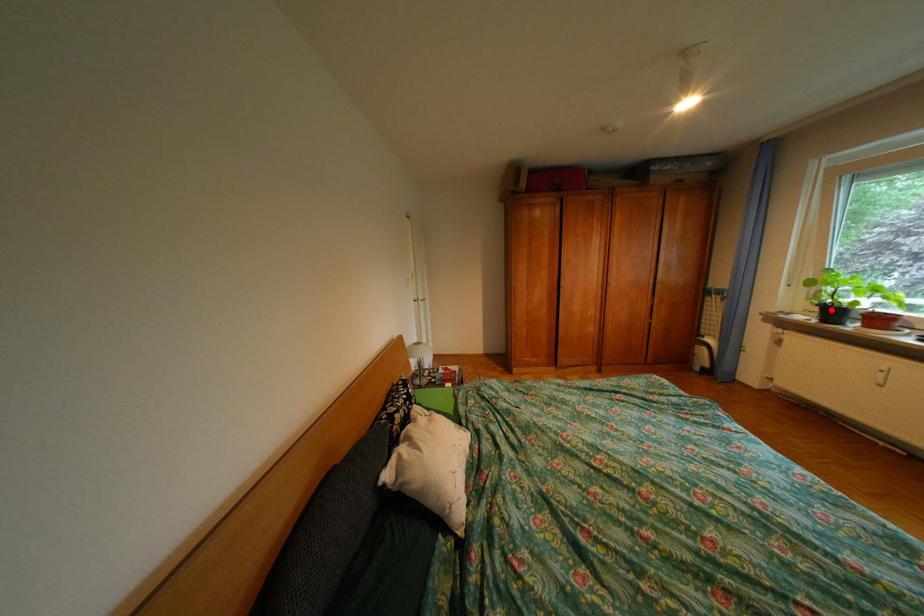
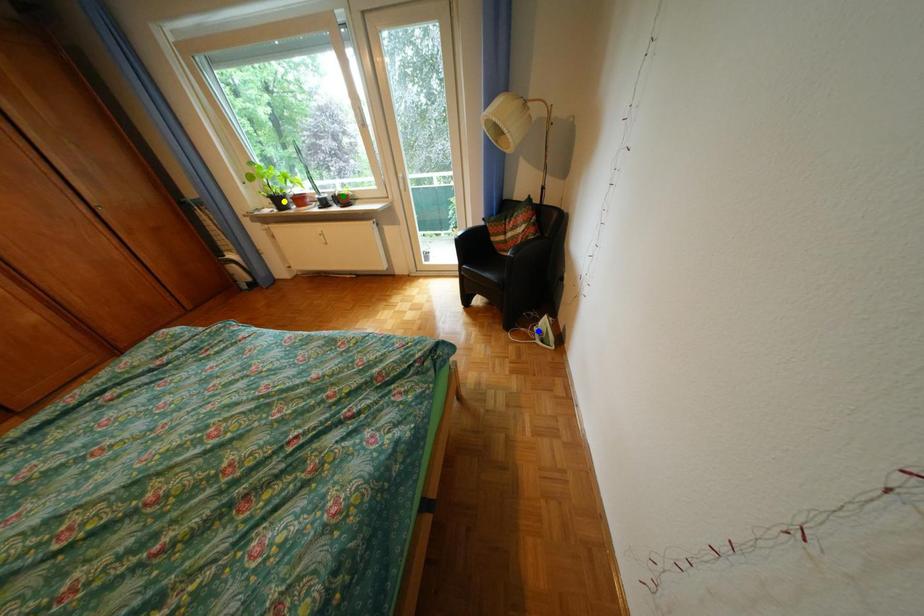
Question: I am providing you with two images of the same scene from different viewpoints. A red point is marked on the first image. You are given multiple points on the second image. Which point in image 2 is actually the same real-world point as the red point in image 1?

Choices:
 (A) blue point
 (B) yellow point
 (C) green point

Answer: (B)